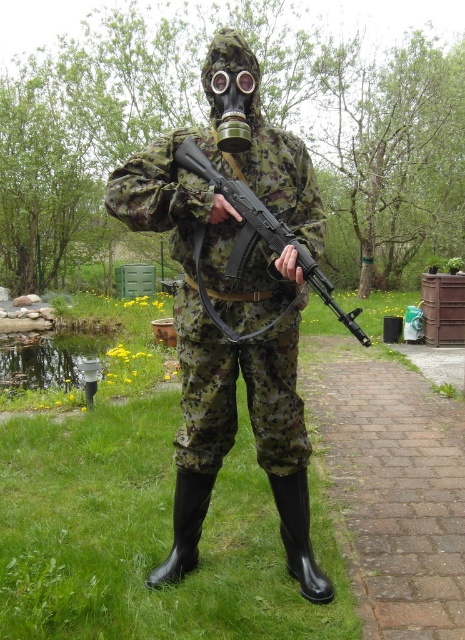
In the scene shown: You are standing in a military training area and need to reach a specific point marked at coordinates point (250, 296). If your current position is 2 meters away from this point, can you safely move forward to reach it without overstepping?

The distance of point (250, 296) from viewer is 2.23 meters. Since your current position is 2 meters away, you can safely move forward 0.23 meters to reach the point without overstepping.

You are a military observer analyzing the image. You need to determine the order of objects from top to bottom. Which object is located above the other between the camouflage fabric uniform at center and the matte black rifle at center?

The matte black rifle at center is above the camouflage fabric uniform at center because the camouflage fabric uniform at center is positioned under it.

You are a military supply officer inspecting a soldier in the field. The soldier is wearing the camouflage fabric uniform at center and carrying the matte black rifle at center. Based on the uniform and rifle, which item is wider?

The camouflage fabric uniform at center is wider than the matte black rifle at center.